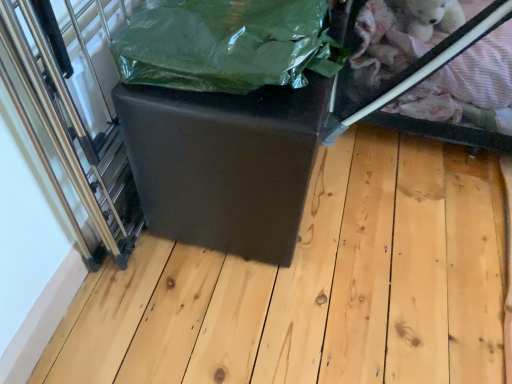
Question: From a real-world perspective, is matte black ottoman at center positioned over transparent plastic glass box at upper right based on gravity?

Choices:
 (A) no
 (B) yes

Answer: (A)

Question: Considering the relative sizes of matte black ottoman at center and transparent plastic glass box at upper right in the image provided, is matte black ottoman at center taller than transparent plastic glass box at upper right?

Choices:
 (A) no
 (B) yes

Answer: (A)

Question: Is matte black ottoman at center not close to transparent plastic glass box at upper right?

Choices:
 (A) no
 (B) yes

Answer: (A)

Question: From the image's perspective, is matte black ottoman at center on transparent plastic glass box at upper right?

Choices:
 (A) no
 (B) yes

Answer: (A)

Question: Is matte black ottoman at center positioned with its back to transparent plastic glass box at upper right?

Choices:
 (A) no
 (B) yes

Answer: (A)

Question: Is point (209, 218) positioned closer to the camera than point (393, 89)?

Choices:
 (A) farther
 (B) closer

Answer: (B)

Question: From the image's perspective, is matte black cube at center above or below transparent plastic glass box at upper right?

Choices:
 (A) below
 (B) above

Answer: (A)

Question: From a real-world perspective, is matte black cube at center positioned above or below transparent plastic glass box at upper right?

Choices:
 (A) below
 (B) above

Answer: (A)

Question: In terms of height, does matte black cube at center look taller or shorter compared to transparent plastic glass box at upper right?

Choices:
 (A) short
 (B) tall

Answer: (A)

Question: Is point (56, 82) positioned closer to the camera than point (302, 127)?

Choices:
 (A) closer
 (B) farther

Answer: (A)

Question: Considering their positions, is transparent plastic glass door at left located in front of or behind matte black cube at center?

Choices:
 (A) behind
 (B) front

Answer: (B)

Question: From a real-world perspective, is transparent plastic glass door at left positioned above or below matte black cube at center?

Choices:
 (A) below
 (B) above

Answer: (B)

Question: Is transparent plastic glass door at left inside or outside of matte black cube at center?

Choices:
 (A) inside
 (B) outside

Answer: (B)

Question: Which is correct: matte black ottoman at center is inside green plastic bag at center, or outside of it?

Choices:
 (A) outside
 (B) inside

Answer: (A)

Question: Considering the positions of matte black ottoman at center and green plastic bag at center in the image, is matte black ottoman at center bigger or smaller than green plastic bag at center?

Choices:
 (A) small
 (B) big

Answer: (B)